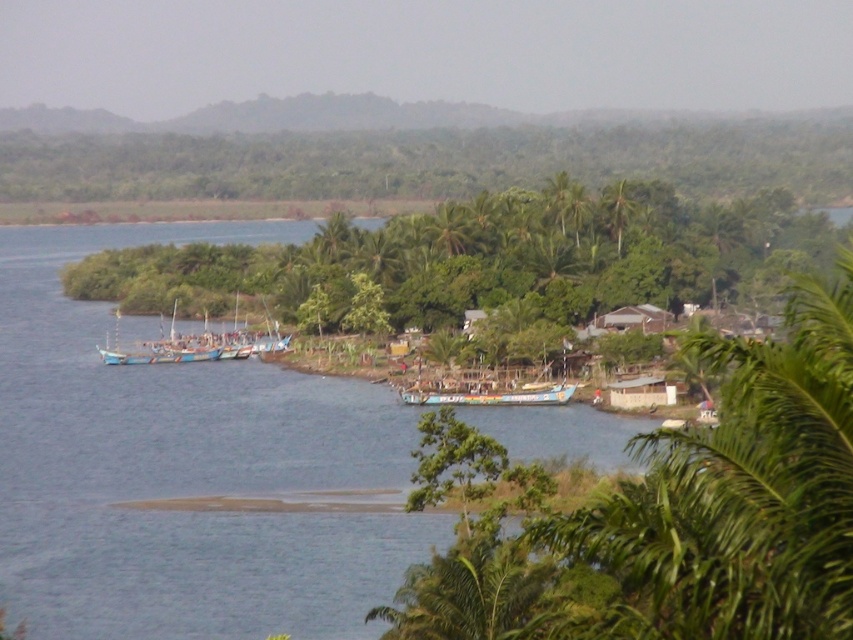
You are a photographer standing at the top of a cliff overlooking the coastal scene. You want to capture a photo that includes both the blue painted wooden boat at center and the green leafy palm tree at center. Based on their positions, which object will appear closer to the bottom of the photo?

The blue painted wooden boat at center is located below the green leafy palm tree at center, so in the photo, the blue painted wooden boat at center will appear closer to the bottom of the photo.

You are a photographer standing at the lower right corner of the frame, surrounded by lush greenery. You want to capture a photo of the blue painted wooden boat at center. Based on your position, is the boat positioned to your left or right side?

The blue painted wooden boat at center is located at point coordinates which would place it to your left side relative to your position at the lower right corner of the frame.

You are a photographer positioned at the lower right corner of the image, where the lush greenery is. You want to take a photo of the blue wooden boats at center. In which direction should you move to get them into your camera frame?

Since the blue wooden boats at center are located at point (187, 346), and you are at the lower right corner, you should move towards the upper left direction to position yourself closer to the center of the image and capture the boats in your frame.